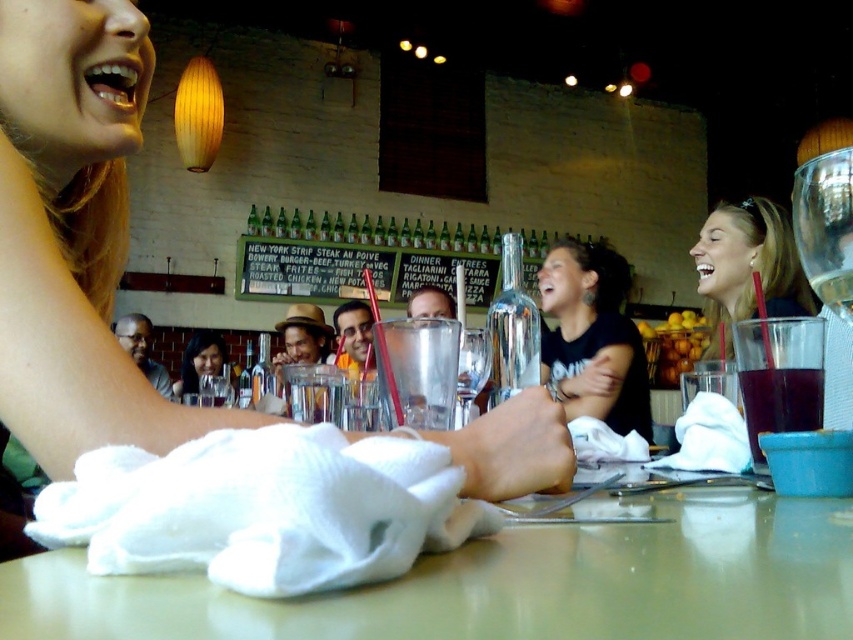
You are a customer sitting at the table in the dining establishment. You want to reach for the translucent plastic cup at lower right. Which direction should you move your hand to grab it?

The translucent plastic cup at lower right is located at point 0.630 on the x axis and 0.916 on the y axis, so you should move your hand towards the lower right direction to grab it.

You are a customer at this dining establishment and you notice a white fabric at center. Can you tell me the exact coordinates where this item is located?

The white fabric at center is located at point [508,582].